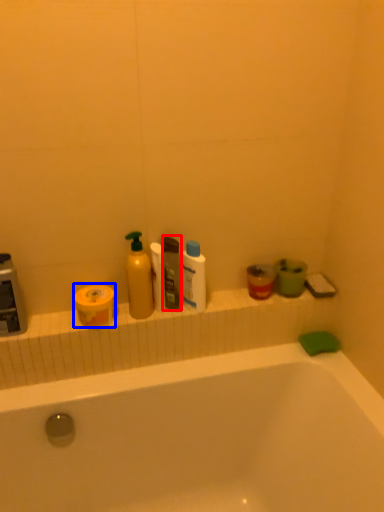
Question: Which object appears closest to the camera in this image, toiletry (highlighted by a red box) or toilet paper (highlighted by a blue box)?

Choices:
 (A) toiletry
 (B) toilet paper

Answer: (B)